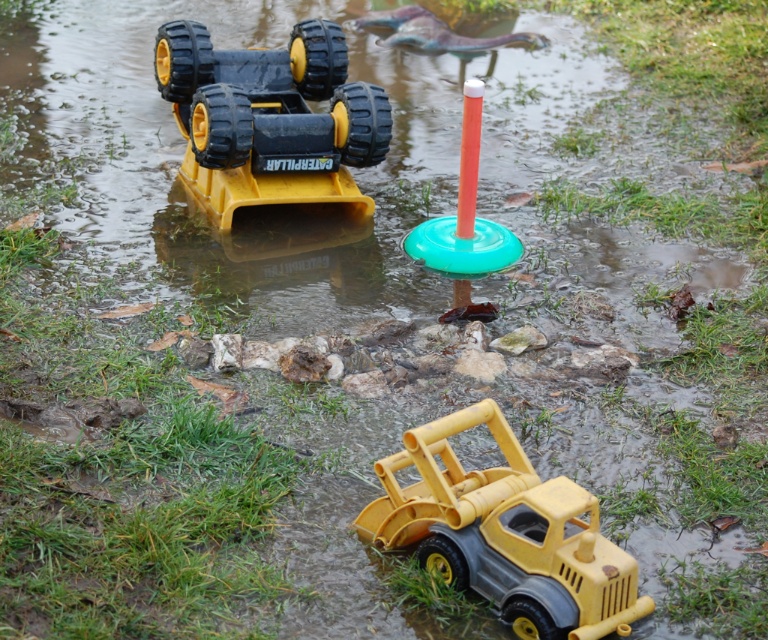
Question: Among these points, which one is farthest from the camera?

Choices:
 (A) (472, 106)
 (B) (270, 195)

Answer: (B)

Question: Is matte black caterpillar truck at upper left wider than green plastic ring at center?

Choices:
 (A) yes
 (B) no

Answer: (A)

Question: Does yellow plastic toy truck at lower center appear on the left side of matte black caterpillar truck at upper left?

Choices:
 (A) no
 (B) yes

Answer: (A)

Question: Which of these objects is positioned farthest from the matte black caterpillar truck at upper left?

Choices:
 (A) yellow plastic toy truck at lower center
 (B) green plastic ring at center

Answer: (A)

Question: Where is matte black caterpillar truck at upper left located in relation to green plastic ring at center in the image?

Choices:
 (A) left
 (B) right

Answer: (A)

Question: Which is nearer to the green plastic ring at center?

Choices:
 (A) yellow plastic toy truck at lower center
 (B) matte black caterpillar truck at upper left

Answer: (B)